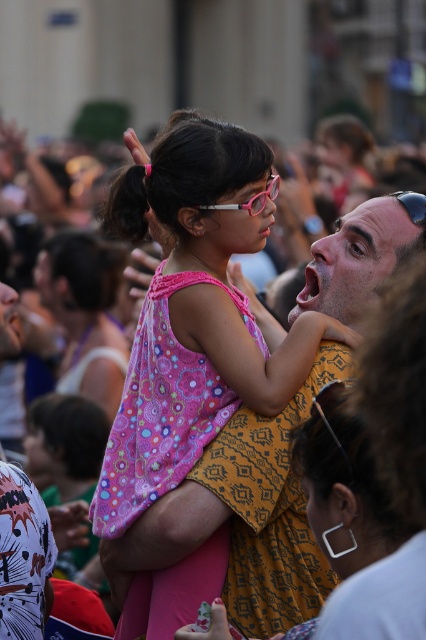
Does pink plastic glasses at center appear on the left side of pink plastic glasses at upper center?

Indeed, pink plastic glasses at center is positioned on the left side of pink plastic glasses at upper center.

Does pink plastic glasses at center have a greater height compared to pink plastic glasses at upper center?

In fact, pink plastic glasses at center may be shorter than pink plastic glasses at upper center.

Describe the element at coordinates (250, 198) in the screenshot. The image size is (426, 640). I see `pink plastic glasses at center` at that location.

Locate an element on the screen. Image resolution: width=426 pixels, height=640 pixels. pink plastic glasses at center is located at coordinates (250, 198).

Who is more distant from viewer, (256,328) or (271,196)?

The point (256,328) is behind.

Can you confirm if pink fabric dress at center is thinner than pink plastic glasses at center?

No.

Find the location of a particular element. The width and height of the screenshot is (426, 640). pink fabric dress at center is located at coordinates (195, 316).

Is point (176, 240) in front of point (405, 193)?

Yes, point (176, 240) is closer to viewer.

Does pink fabric dress at center have a larger size compared to pink plastic glasses at upper center?

No.

Between point (135, 403) and point (416, 202), which one is positioned in front?

Point (135, 403) is more forward.

Locate an element on the screen. pink fabric dress at center is located at coordinates (195, 316).